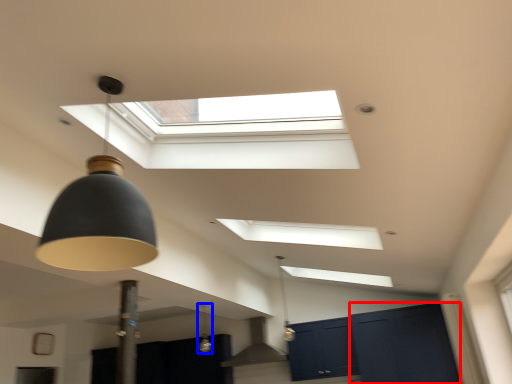
Question: Among these objects, which one is farthest to the camera, glass door (highlighted by a red box) or lamp (highlighted by a blue box)?

Choices:
 (A) glass door
 (B) lamp

Answer: (A)